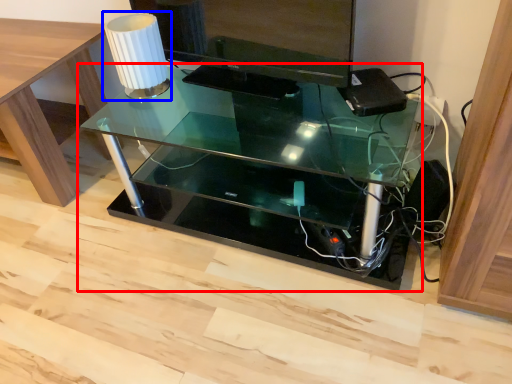
Question: Which of the following is the farthest to the observer, table (highlighted by a red box) or table lamp (highlighted by a blue box)?

Choices:
 (A) table
 (B) table lamp

Answer: (B)